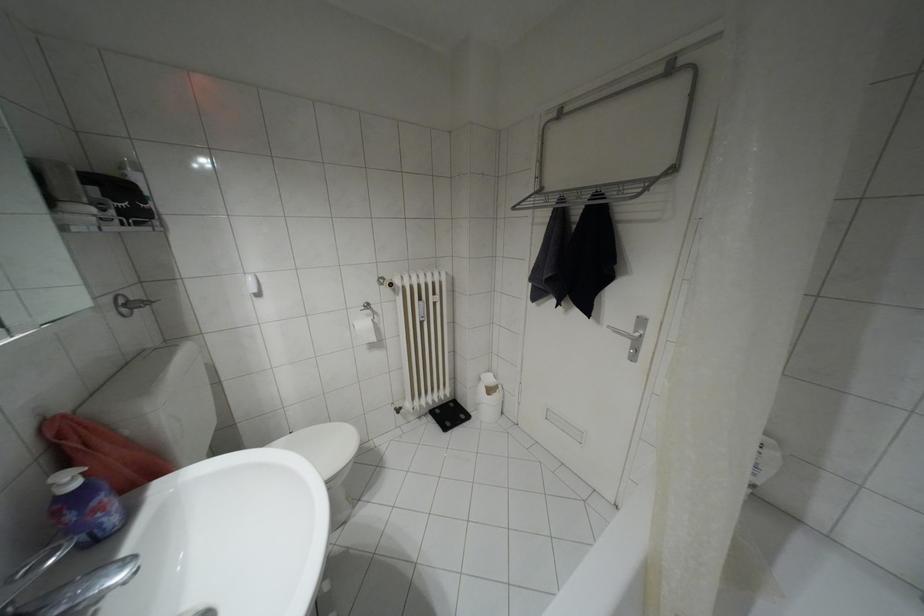
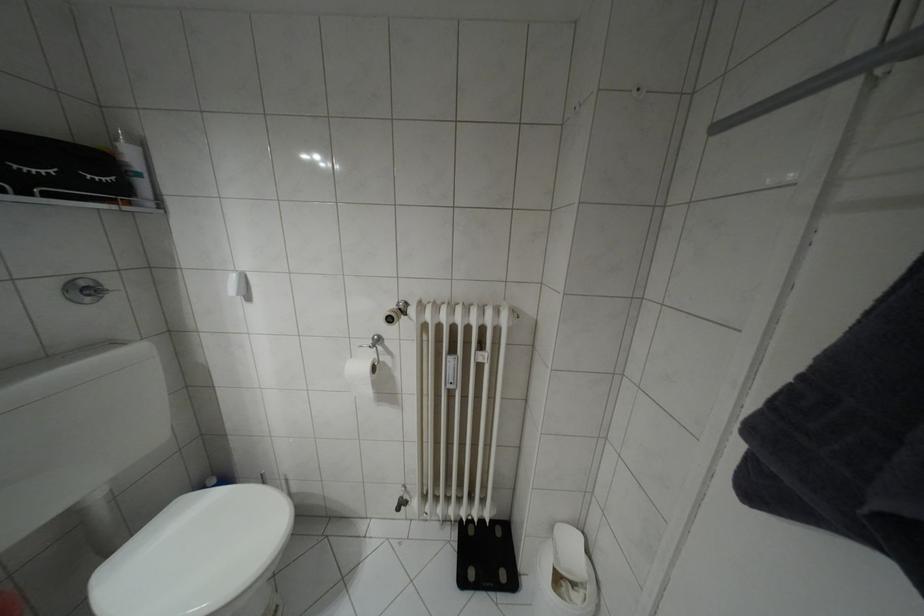
Find the pixel in the second image that matches the point at 138,224 in the first image.

(49, 195)